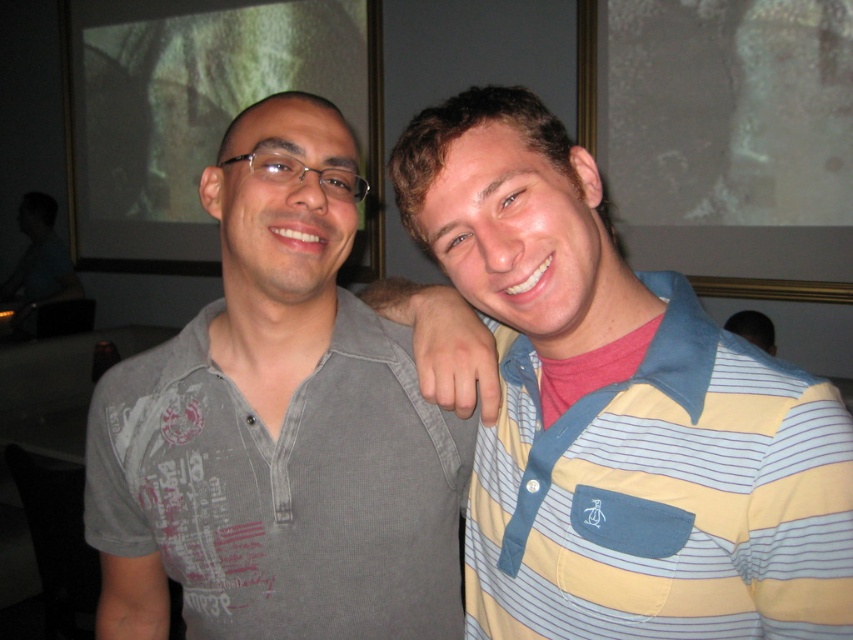
From the picture: You are a photographer in a dimly lit bar setting. You need to adjust your camera focus to capture both the gray cotton shirt at left and the yellow and blue striped polo shirt at right clearly. Since the two shirts are positioned side by side, which shirt should you focus on first to ensure both are in focus?

The gray cotton shirt at left is to the left of the yellow and blue striped polo shirt at right. To ensure both are in focus, you should focus on the gray cotton shirt at left first, as it is closer to the camera, allowing the depth of field to cover the yellow and blue striped polo shirt at right.

You are a photographer who wants to capture a clear photo of both the gray cotton shirt at left and the yellow and blue striped polo shirt at right. However, your camera can only focus on one subject at a time. Based on their positions, which shirt should you focus on to ensure the other is still in focus?

The gray cotton shirt at left might be wider than the yellow and blue striped polo shirt at right, so focusing on the wider shirt could help keep both in focus.

You are a security camera in the bar. You need to determine if the gray cotton shirt at left is within the restricted area marked from coordinates 0.5 to 0.8 on the x and y axes. Is it inside?

The gray cotton shirt at left is at coordinates (277, 428). The restricted area spans from 0.5 to 0.8 on both axes. Since the x coordinate 0.669 is within 0.5 to 0.8, but the y coordinate 0.326 is below 0.5, the gray cotton shirt at left is partially inside the restricted area on the x axis but not fully within on the y axis. However, since the restricted area requires both coordinates to be within the range, the shirt is not entirely inside.